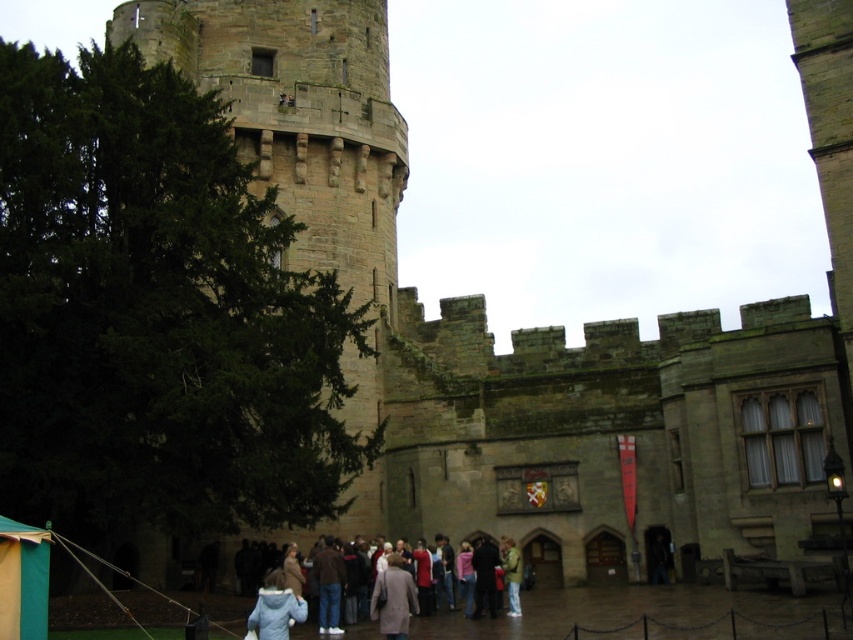
Question: Which object is farther from the camera taking this photo?

Choices:
 (A) light brown leather jacket at center
 (B) light blue denim jacket at lower center

Answer: (A)

Question: Is brown stone tower at left above light gray wool coat at center?

Choices:
 (A) yes
 (B) no

Answer: (A)

Question: Can you confirm if brown stone tower at left is positioned to the right of light gray wool coat at center?

Choices:
 (A) no
 (B) yes

Answer: (A)

Question: Which is farther from the light gray wool coat at center?

Choices:
 (A) brown stone tower at left
 (B) light blue denim jacket at lower center
 (C) light brown leather jacket at center
 (D) light blue fleece jacket at lower center

Answer: (A)

Question: Can you confirm if brown stone tower at left is positioned to the right of light blue fleece jacket at lower center?

Choices:
 (A) yes
 (B) no

Answer: (B)

Question: Which object appears closest to the camera in this image?

Choices:
 (A) light blue denim jacket at lower center
 (B) brown stone tower at left
 (C) light gray wool coat at center
 (D) light blue fleece jacket at lower center

Answer: (D)